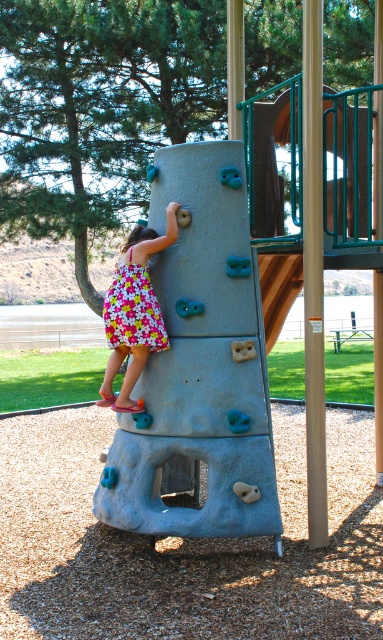
Question: Among these objects, which one is nearest to the camera?

Choices:
 (A) floral cotton dress at center
 (B) wooden at center

Answer: (A)

Question: Is floral cotton dress at center to the right of wooden at center from the viewer's perspective?

Choices:
 (A) no
 (B) yes

Answer: (A)

Question: Which point is farther to the camera?

Choices:
 (A) (273, 314)
 (B) (129, 260)

Answer: (A)

Question: Which of the following is the farthest from the observer?

Choices:
 (A) floral cotton dress at center
 (B) wooden at center
 (C) floral fabric dress at center

Answer: (B)

Question: Is floral cotton dress at center positioned at the back of wooden at center?

Choices:
 (A) no
 (B) yes

Answer: (A)

Question: Can you confirm if floral cotton dress at center is smaller than wooden at center?

Choices:
 (A) yes
 (B) no

Answer: (A)